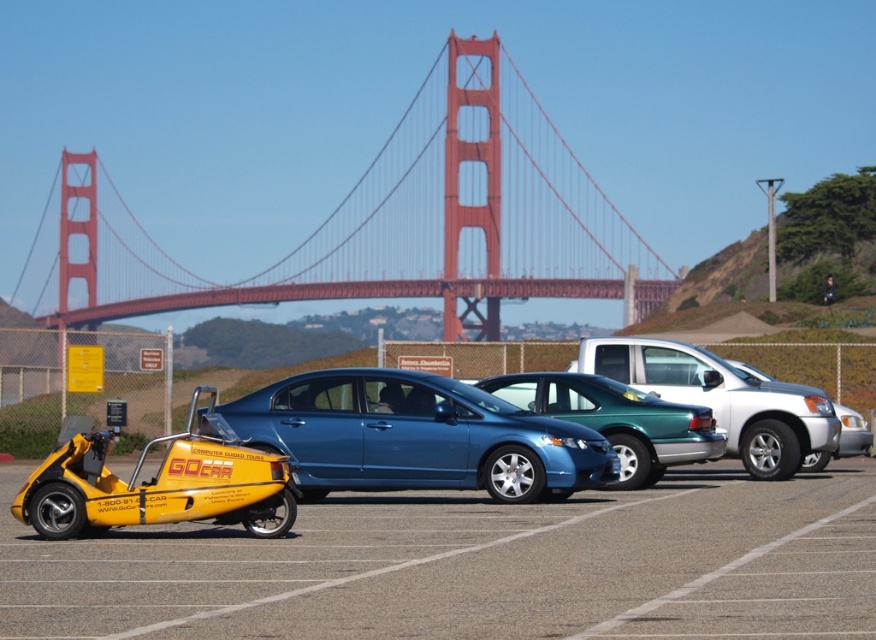
You are planning to rent a vehicle and want to know which one is shorter between the yellow matte gocar at lower left and the blue metallic sedan at center. Can you tell me?

The yellow matte gocar at lower left is not as tall as the blue metallic sedan at center, so the yellow matte gocar at lower left is shorter.